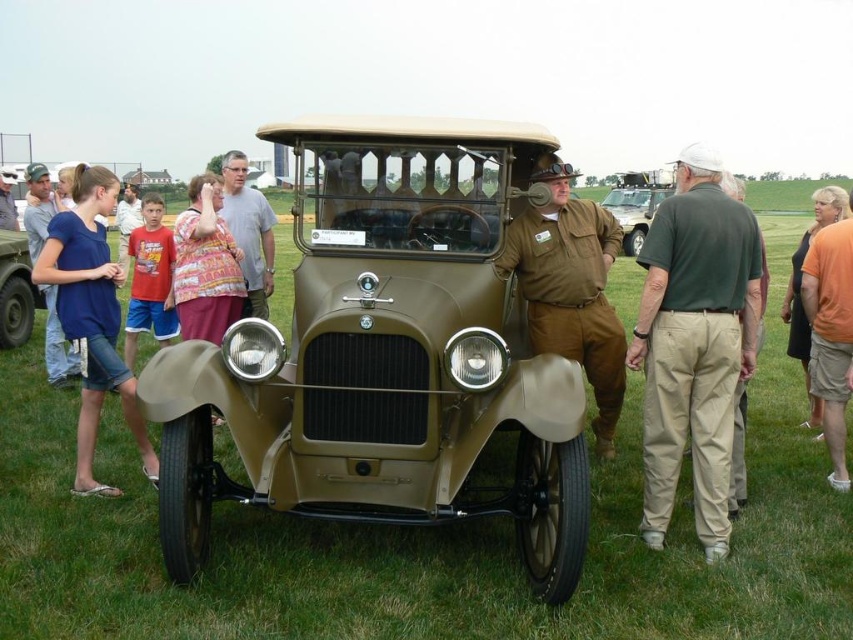
You are standing in front of the vintage car and want to take a photo that includes both the point at position (675, 241) and the point at (795, 355). Which point will appear closer to the camera in your photo?

The point at position (675, 241) will appear closer to the camera in the photo because it is closer to the camera than point (795, 355).